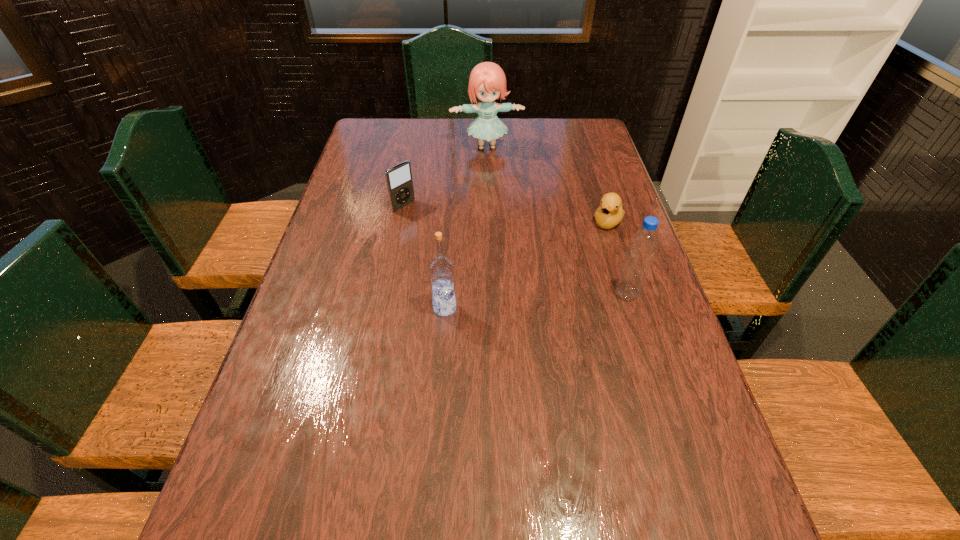
Locate an element on the screen. free space that satisfies the following two spatial constraints: 1. on the front side of the tallest object; 2. on the left side of the water bottle is located at coordinates (490, 294).

What are the coordinates of `blank space that satisfies the following two spatial constraints: 1. on the back side of the shortest object; 2. on the left side of the vodka` in the screenshot? It's located at (451, 221).